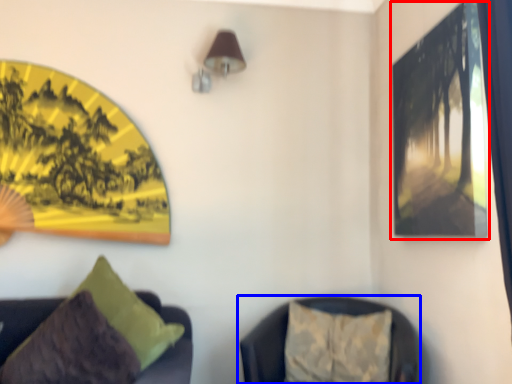
Question: Which object is further to the camera taking this photo, picture frame (highlighted by a red box) or furniture (highlighted by a blue box)?

Choices:
 (A) picture frame
 (B) furniture

Answer: (B)